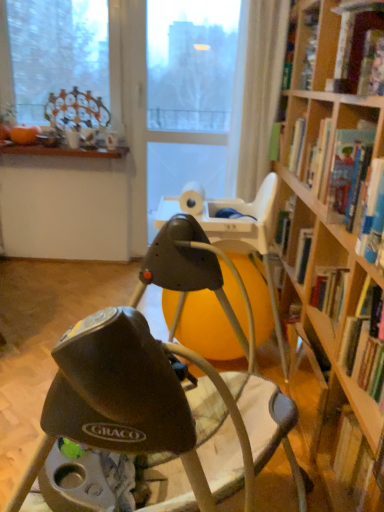
Question: Can hardcover book at right, which is the 3th book in top-to-bottom order, be found inside transparent plastic screen door at center?

Choices:
 (A) yes
 (B) no

Answer: (B)

Question: From a real-world perspective, does transparent plastic screen door at center sit lower than hardcover book at right, which is the first book from bottom to top?

Choices:
 (A) no
 (B) yes

Answer: (A)

Question: Is transparent plastic screen door at center not near hardcover book at right, which is the first book from bottom to top?

Choices:
 (A) yes
 (B) no

Answer: (A)

Question: Is transparent plastic screen door at center turned away from hardcover book at right, which is the 3th book in top-to-bottom order?

Choices:
 (A) no
 (B) yes

Answer: (A)

Question: Could you tell me if transparent plastic screen door at center is turned towards hardcover book at right, which is the 3th book in top-to-bottom order?

Choices:
 (A) no
 (B) yes

Answer: (B)

Question: Is the position of transparent plastic screen door at center more distant than that of hardcover book at right, which is the first book from bottom to top?

Choices:
 (A) yes
 (B) no

Answer: (A)

Question: Considering the relative sizes of transparent plastic screen door at center and hardcover book at upper right, the 2th book from the top, in the image provided, is transparent plastic screen door at center bigger than hardcover book at upper right, the 2th book from the top,?

Choices:
 (A) yes
 (B) no

Answer: (A)

Question: From the image's perspective, would you say transparent plastic screen door at center is shown under hardcover book at upper right, the 2th book from the top?

Choices:
 (A) no
 (B) yes

Answer: (A)

Question: Are transparent plastic screen door at center and hardcover book at upper right, the 2th book from the top, located far from each other?

Choices:
 (A) yes
 (B) no

Answer: (A)

Question: Are transparent plastic screen door at center and hardcover book at upper right, arranged as the second book when ordered from the bottom, beside each other?

Choices:
 (A) no
 (B) yes

Answer: (A)

Question: Considering the relative sizes of transparent plastic screen door at center and hardcover book at upper right, the 2th book from the top, in the image provided, is transparent plastic screen door at center smaller than hardcover book at upper right, the 2th book from the top,?

Choices:
 (A) no
 (B) yes

Answer: (A)

Question: Considering the relative positions of transparent plastic screen door at center and hardcover book at upper right, arranged as the second book when ordered from the bottom, in the image provided, is transparent plastic screen door at center in front of hardcover book at upper right, arranged as the second book when ordered from the bottom,?

Choices:
 (A) no
 (B) yes

Answer: (A)

Question: Is matte black baby swing at center taller than transparent plastic screen door at center?

Choices:
 (A) yes
 (B) no

Answer: (B)